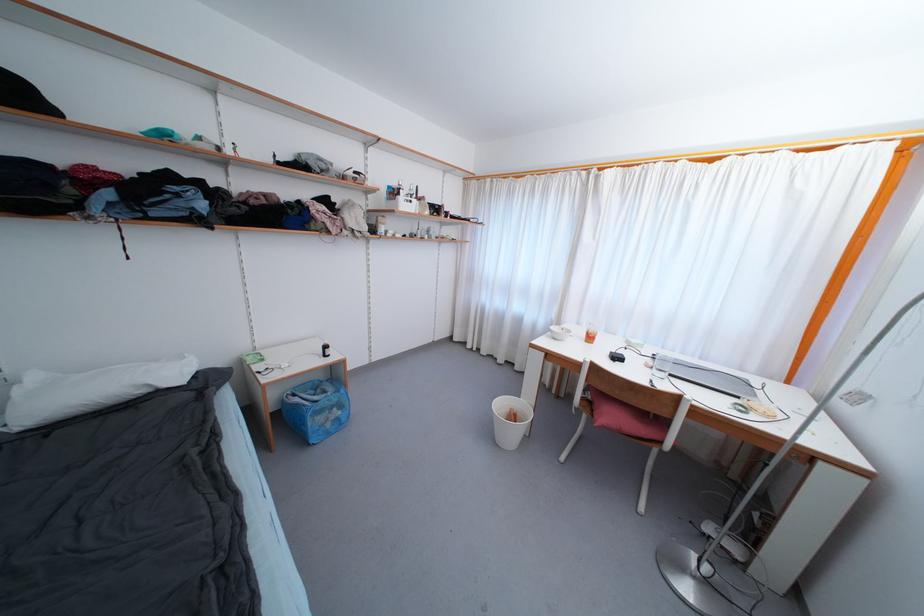
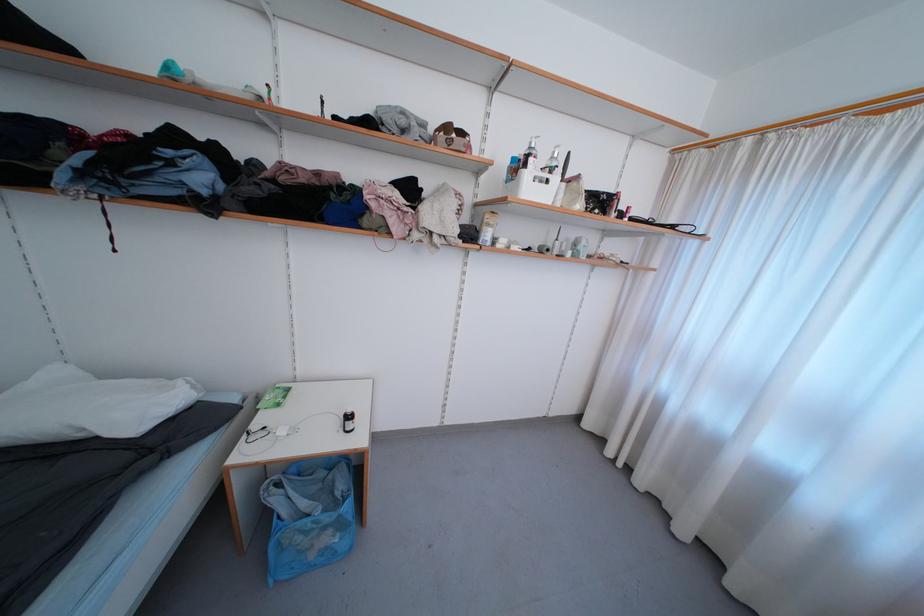
In the second image, find the point that corresponds to (x=403, y=196) in the first image.

(529, 168)